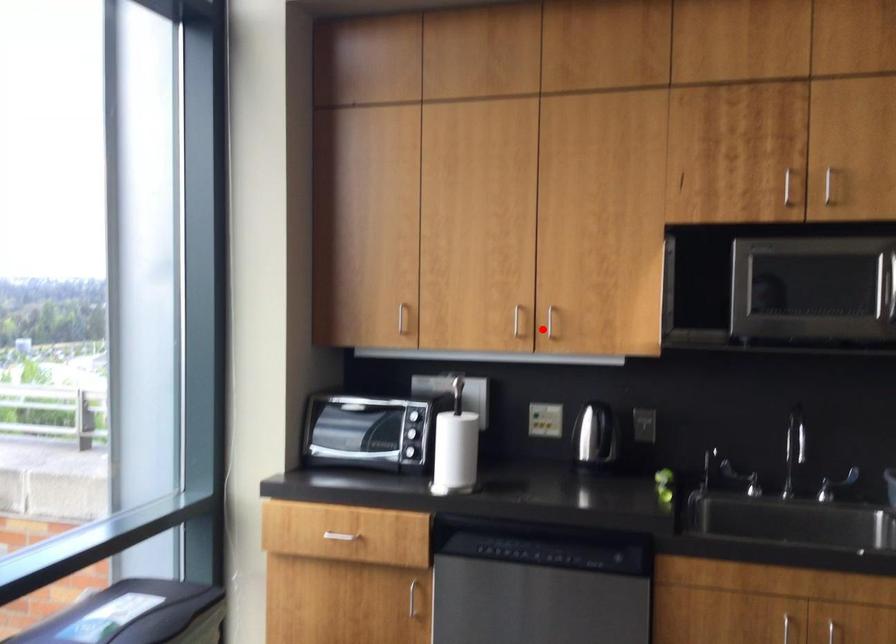
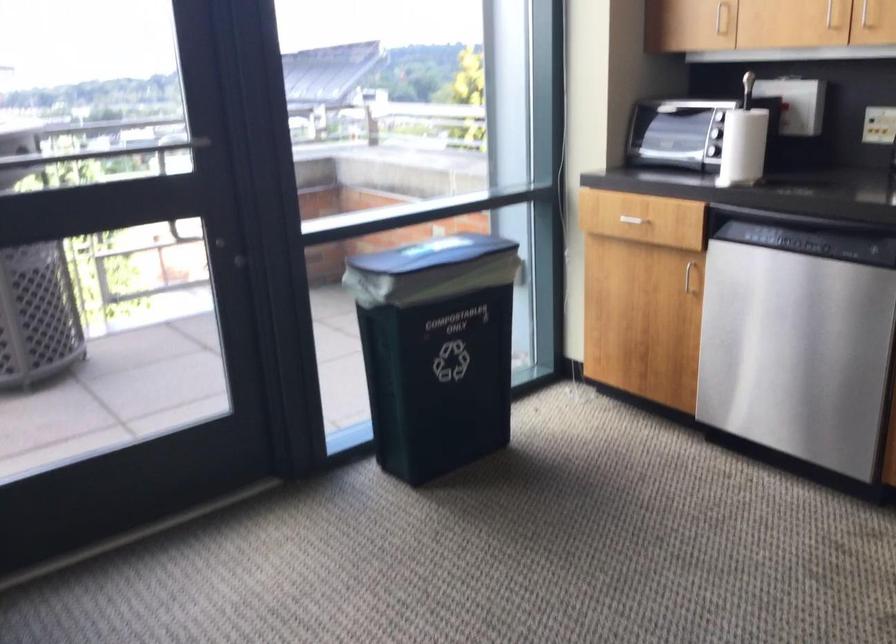
Where in the second image is the point corresponding to the highlighted location from the first image?

(865, 15)